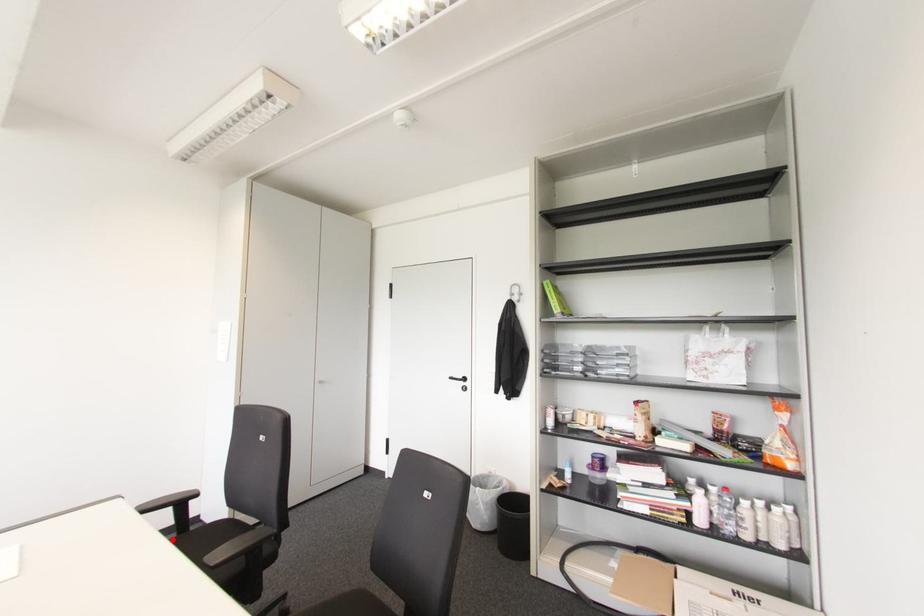
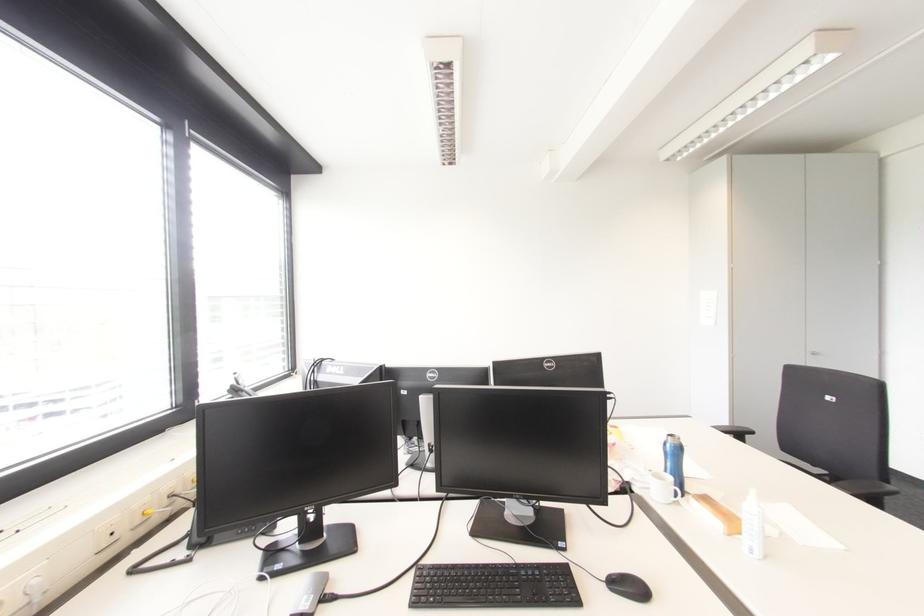
Question: I am providing you with two images of the same scene from different viewpoints. A red point is marked on the first image. Can you still see the location of the red point in image 2?

Choices:
 (A) Yes
 (B) No

Answer: (B)